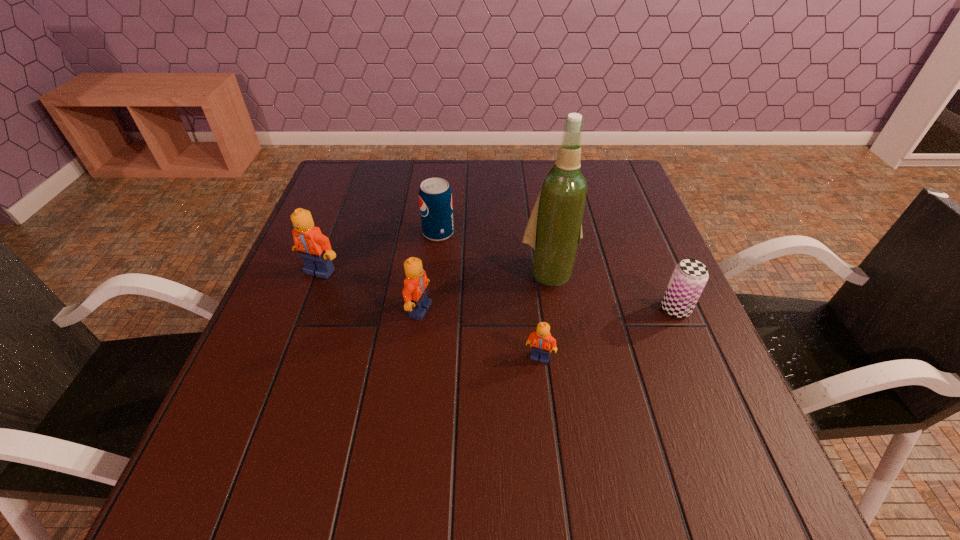
Where is `free point that satisfies the following two spatial constraints: 1. on the front side of the beer can; 2. on the front-facing side of the second Lego from right to left`? The image size is (960, 540). free point that satisfies the following two spatial constraints: 1. on the front side of the beer can; 2. on the front-facing side of the second Lego from right to left is located at coordinates (676, 310).

In order to click on free spot that satisfies the following two spatial constraints: 1. on the front side of the pop; 2. on the front-facing side of the second farthest Lego in this screenshot , I will do `click(430, 310)`.

This screenshot has height=540, width=960. I want to click on vacant space that satisfies the following two spatial constraints: 1. on the front-facing side of the beer can; 2. on the left side of the leftmost Lego, so click(305, 309).

The image size is (960, 540). What are the coordinates of `blank area in the image that satisfies the following two spatial constraints: 1. on the front-facing side of the beer can; 2. on the left side of the tallest object` in the screenshot? It's located at (556, 309).